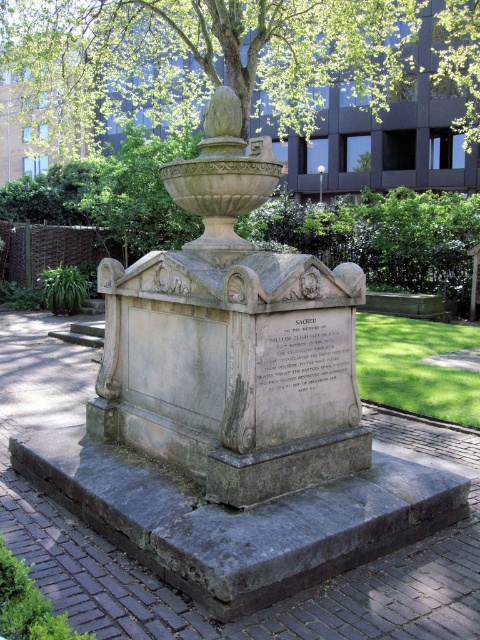
Who is positioned more to the right, stone monument at center or green leafy tree at upper center?

green leafy tree at upper center is more to the right.

Consider the image. Can you confirm if stone monument at center is positioned above green leafy tree at upper center?

Actually, stone monument at center is below green leafy tree at upper center.

I want to click on stone monument at center, so click(231, 339).

Where is `stone monument at center`? stone monument at center is located at coordinates (231, 339).